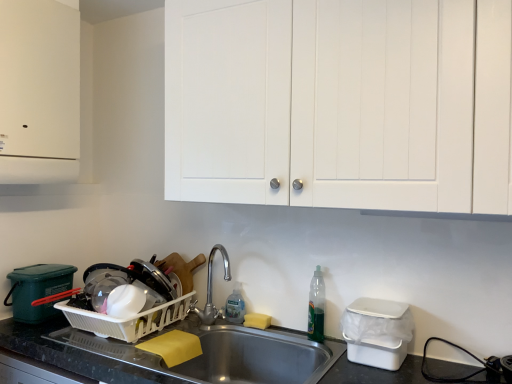
Question: From a real-world perspective, is white plastic container at lower right, which is the first appliance in right-to-left order, located higher than clear plastic bottle at sink, positioned as the 1th bottle in left-to-right order?

Choices:
 (A) yes
 (B) no

Answer: (A)

Question: Is white plastic container at lower right, the second appliance in the left-to-right sequence, thinner than clear plastic bottle at sink, the second bottle viewed from the front?

Choices:
 (A) no
 (B) yes

Answer: (A)

Question: Is white plastic container at lower right, positioned as the first appliance in front-to-back order, positioned beyond the bounds of clear plastic bottle at sink, the second bottle viewed from the front?

Choices:
 (A) yes
 (B) no

Answer: (A)

Question: Is white plastic container at lower right, the second appliance in the left-to-right sequence, aimed at clear plastic bottle at sink, positioned as the 1th bottle in left-to-right order?

Choices:
 (A) no
 (B) yes

Answer: (A)

Question: Can you confirm if white plastic container at lower right, which is the first appliance in right-to-left order, is shorter than clear plastic bottle at sink, the 1th bottle from the back?

Choices:
 (A) yes
 (B) no

Answer: (B)

Question: Considering the relative positions of white plastic container at lower right, the second appliance in the left-to-right sequence, and clear plastic bottle at sink, the 2th bottle positioned from the right, in the image provided, is white plastic container at lower right, the second appliance in the left-to-right sequence, behind clear plastic bottle at sink, the 2th bottle positioned from the right,?

Choices:
 (A) yes
 (B) no

Answer: (B)

Question: Would you say white plastic container at lower right, placed as the second appliance when sorted from back to front, is part of white matte cabinet at upper left, the 1th cabinetry positioned from the left,'s contents?

Choices:
 (A) no
 (B) yes

Answer: (A)

Question: From a real-world perspective, is white matte cabinet at upper left, the 1th cabinetry positioned from the left, on top of white plastic container at lower right, placed as the second appliance when sorted from back to front?

Choices:
 (A) yes
 (B) no

Answer: (A)

Question: Does white matte cabinet at upper left, the 1th cabinetry positioned from the left, appear on the left side of white plastic container at lower right, placed as the second appliance when sorted from back to front?

Choices:
 (A) no
 (B) yes

Answer: (B)

Question: From a real-world perspective, is white matte cabinet at upper left, the 1th cabinetry positioned from the left, physically below white plastic container at lower right, which is the first appliance in right-to-left order?

Choices:
 (A) yes
 (B) no

Answer: (B)

Question: Does white matte cabinet at upper left, the 1th cabinetry positioned from the left, turn towards white plastic container at lower right, the second appliance in the left-to-right sequence?

Choices:
 (A) yes
 (B) no

Answer: (A)

Question: Can you confirm if white matte cabinet at upper left, the 1th cabinetry positioned from the left, is thinner than white plastic container at lower right, placed as the second appliance when sorted from back to front?

Choices:
 (A) no
 (B) yes

Answer: (A)

Question: Considering the relative sizes of translucent plastic bottle at sink right, which is counted as the 1th bottle, starting from the right, and white plastic dish rack at lower left, marked as the 2th appliance in a front-to-back arrangement, in the image provided, is translucent plastic bottle at sink right, which is counted as the 1th bottle, starting from the right, thinner than white plastic dish rack at lower left, marked as the 2th appliance in a front-to-back arrangement,?

Choices:
 (A) no
 (B) yes

Answer: (B)